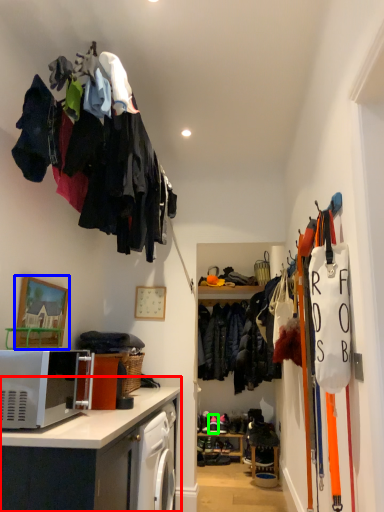
Question: Which object is positioned farthest from cabinetry (highlighted by a red box)? Select from picture frame (highlighted by a blue box) and footwear (highlighted by a green box).

Choices:
 (A) picture frame
 (B) footwear

Answer: (B)